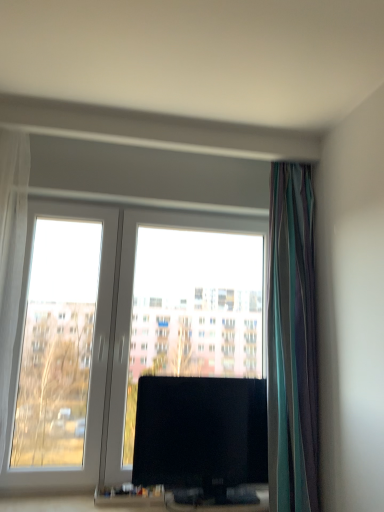
Question: Is point (18, 292) positioned closer to the camera than point (281, 315)?

Choices:
 (A) farther
 (B) closer

Answer: (B)

Question: Is white sheer curtain at left, which is the 2th curtain from right to left, taller or shorter than striped fabric curtain at right, the 1th curtain when ordered from right to left?

Choices:
 (A) tall
 (B) short

Answer: (B)

Question: Which is farther from the transparent glass window at center?

Choices:
 (A) black glossy tv at center
 (B) striped fabric curtain at right, marked as the 2th curtain in a left-to-right arrangement
 (C) white sheer curtain at left, which is the 1th curtain in left-to-right order

Answer: (B)

Question: Based on their relative distances, which object is nearer to the striped fabric curtain at right, marked as the 2th curtain in a left-to-right arrangement?

Choices:
 (A) white sheer curtain at left, which is the 1th curtain in left-to-right order
 (B) transparent glass window at center
 (C) black glossy tv at center

Answer: (C)